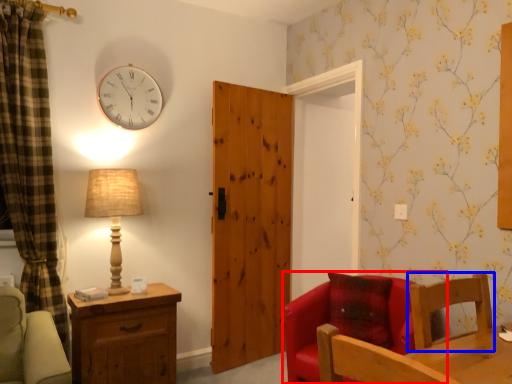
Question: Which object appears closest to the camera in this image, chair (highlighted by a red box) or chair (highlighted by a blue box)?

Choices:
 (A) chair
 (B) chair

Answer: (B)